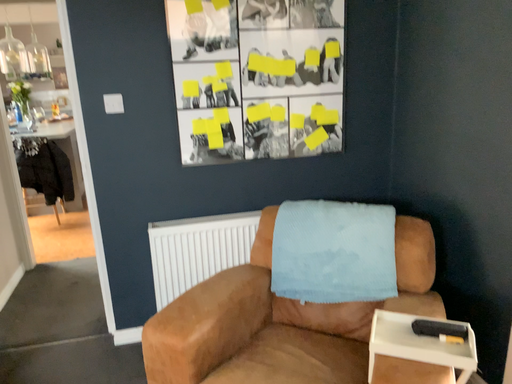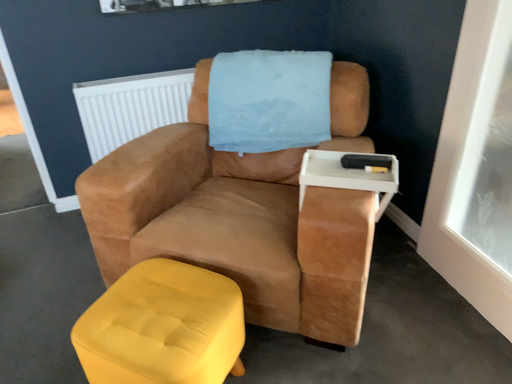
Question: How did the camera likely rotate when shooting the video?

Choices:
 (A) rotated left
 (B) rotated right

Answer: (B)